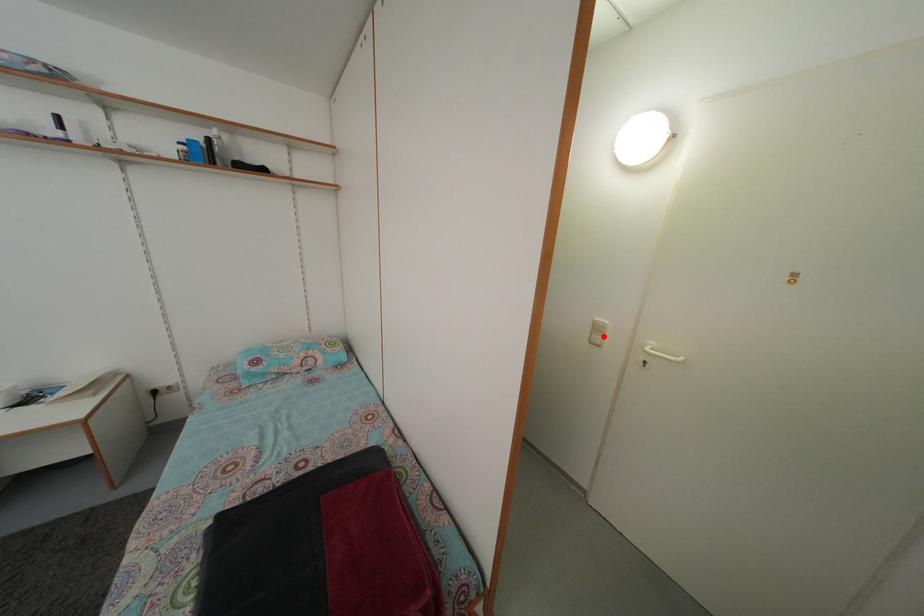
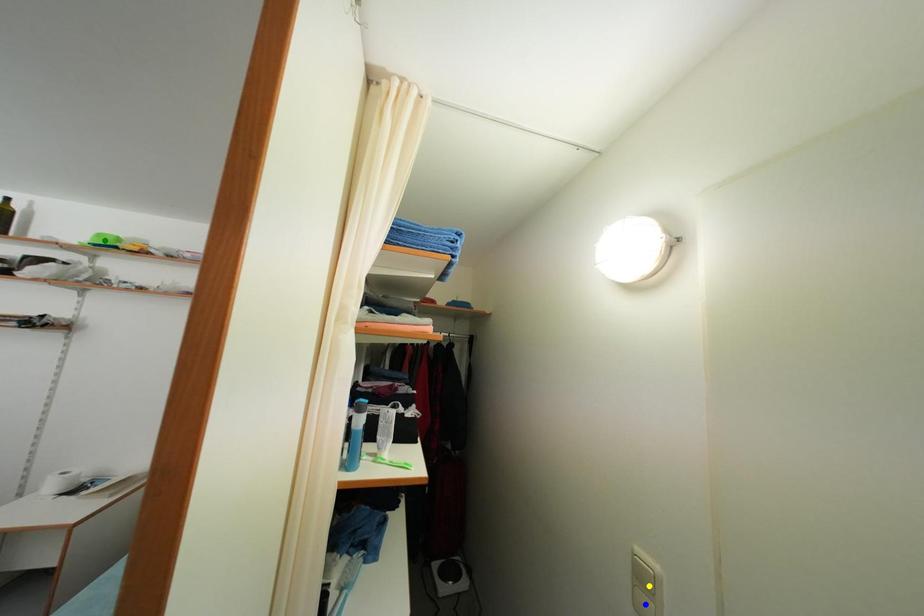
Question: I am providing you with two images of the same scene from different viewpoints. A red point is marked on the first image. You are given multiple points on the second image. In image 2, which mark is for the same physical point as the one in image 1?

Choices:
 (A) blue point
 (B) yellow point
 (C) green point

Answer: (B)